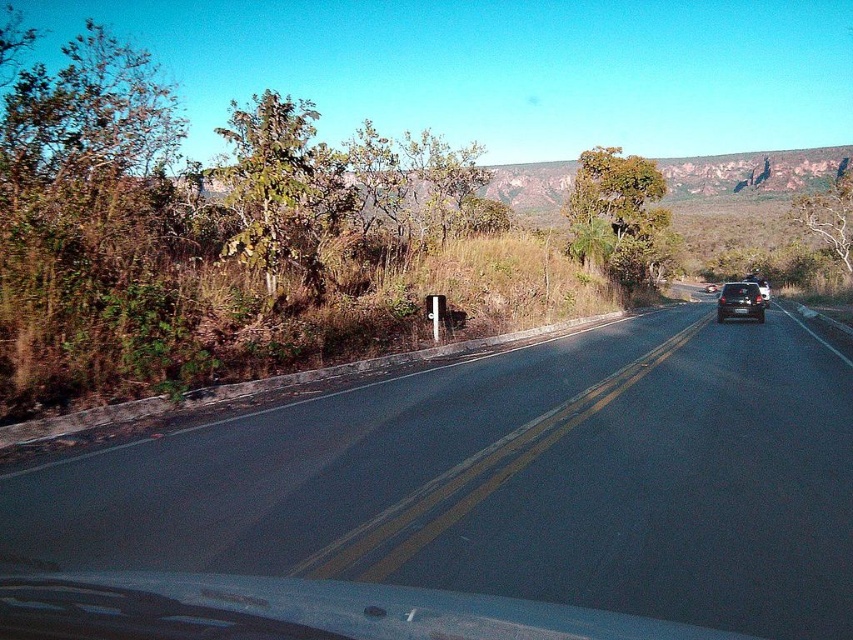
Is black asphalt road at center wider than satin black car at right?

Yes.

This screenshot has height=640, width=853. In order to click on black asphalt road at center in this screenshot , I will do `click(508, 481)`.

You are a GUI agent. You are given a task and a screenshot of the screen. Output one action in this format:
    pyautogui.click(x=<x>, y=<y>)
    Task: Click on the black asphalt road at center
    This screenshot has width=853, height=640.
    Given the screenshot: What is the action you would take?
    508,481